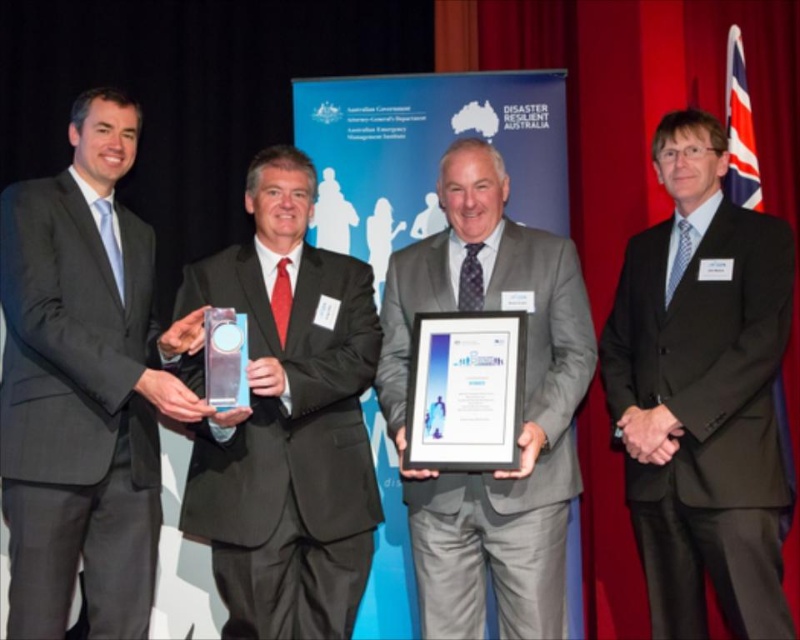
Is black suit at right smaller than matte black suit at center?

No.

Is black suit at right wider than matte black suit at center?

In fact, black suit at right might be narrower than matte black suit at center.

Is point (726, 291) farther from camera compared to point (360, 262)?

No, (726, 291) is closer to viewer.

This screenshot has height=640, width=800. What are the coordinates of `black suit at right` in the screenshot? It's located at (702, 392).

Which of these two, matte black suit at center or gray suit at center, stands taller?

With more height is gray suit at center.

Find the location of a particular element. This screenshot has width=800, height=640. matte black suit at center is located at coordinates (284, 419).

Is black suit at left behind black suit at right?

No, it is not.

Does point (26, 452) lie behind point (768, 486)?

No, (26, 452) is in front of (768, 486).

What are the coordinates of `black suit at left` in the screenshot? It's located at (82, 387).

What are the coordinates of `black suit at left` in the screenshot? It's located at (82, 387).